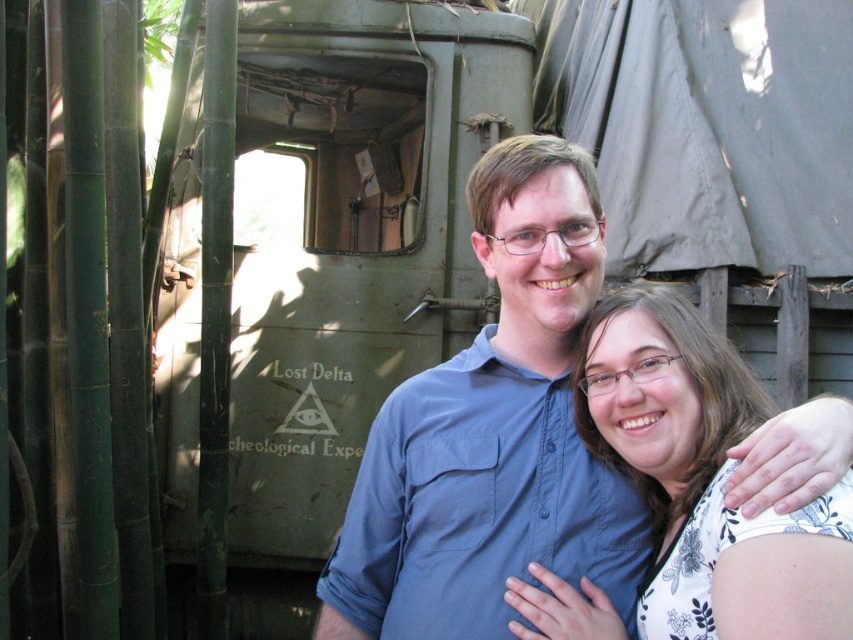
Is blue cotton shirt at center above white floral blouse at center?

Yes.

Who is more forward, (579, 180) or (704, 449)?

Point (704, 449) is more forward.

Which is in front, point (561, 404) or point (608, 611)?

Point (608, 611)

Locate an element on the screen. The width and height of the screenshot is (853, 640). blue cotton shirt at center is located at coordinates (492, 435).